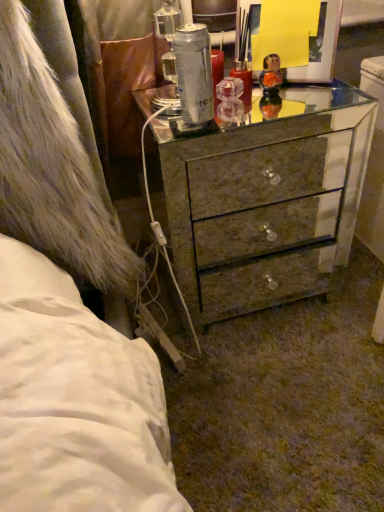
The height and width of the screenshot is (512, 384). In order to click on vacant space that is to the left of translucent glass figurine at upper center in this screenshot , I will do `click(222, 109)`.